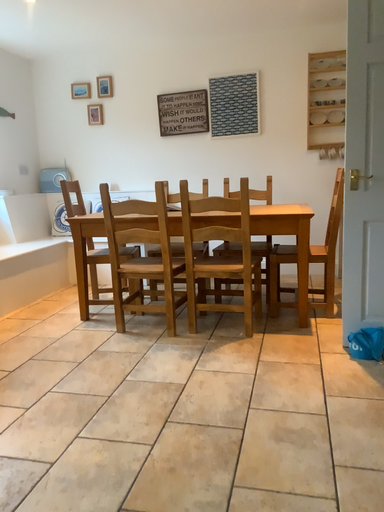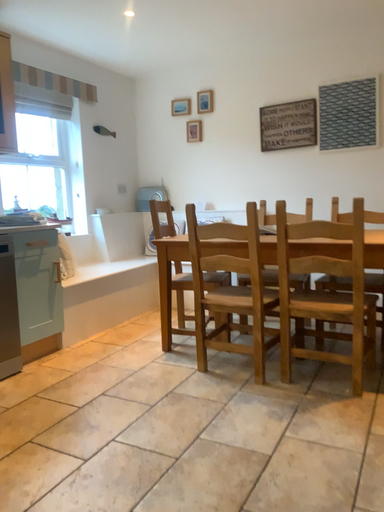
Question: How did the camera likely rotate when shooting the video?

Choices:
 (A) rotated left
 (B) rotated right

Answer: (A)